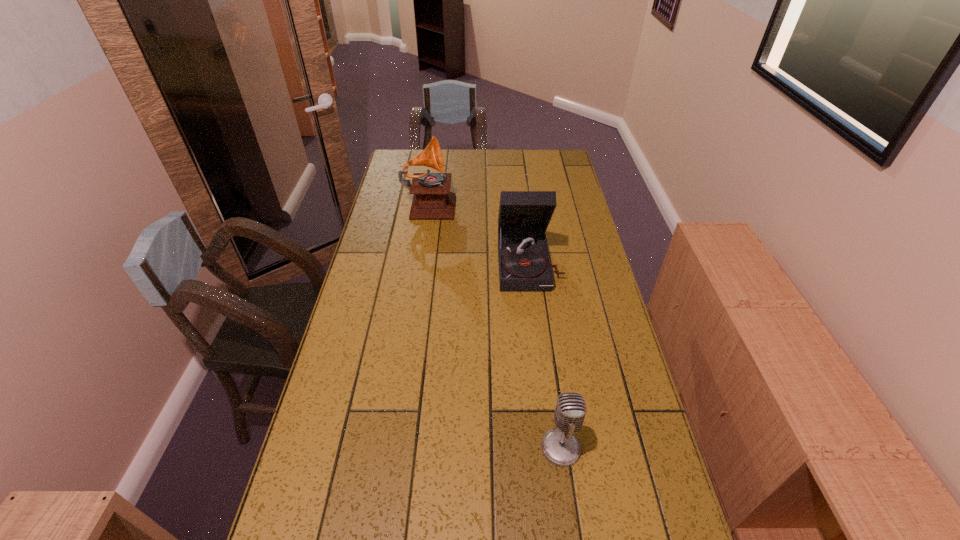
At what (x,y) coordinates should I click in order to perform the action: click on free space between the nearer phonograph_record and the nearest object. Please return your answer as a coordinate pair (x, y). The width and height of the screenshot is (960, 540). Looking at the image, I should click on (545, 355).

This screenshot has width=960, height=540. In order to click on free spot between the farther phonograph_record and the nearer phonograph_record in this screenshot , I will do `click(479, 233)`.

I want to click on blank region between the leftmost object and the right phonograph_record, so click(x=479, y=233).

I want to click on empty space between the second farthest object and the left phonograph_record, so click(479, 233).

This screenshot has height=540, width=960. I want to click on free spot between the right phonograph_record and the farthest object, so click(479, 233).

Select which object is the closest to the microphone. Please provide its 2D coordinates. Your answer should be formatted as a tuple, i.e. [(x, y)], where the tuple contains the x and y coordinates of a point satisfying the conditions above.

[(524, 263)]

Locate which object ranks second in proximity to the shortest object. Please provide its 2D coordinates. Your answer should be formatted as a tuple, i.e. [(x, y)], where the tuple contains the x and y coordinates of a point satisfying the conditions above.

[(432, 200)]

Where is `vacant space that satisfies the following two spatial constraints: 1. on the front-facing side of the nearest object; 2. on the left side of the second nearest object`? The image size is (960, 540). vacant space that satisfies the following two spatial constraints: 1. on the front-facing side of the nearest object; 2. on the left side of the second nearest object is located at coordinates (x=552, y=448).

Find the location of a particular element. Image resolution: width=960 pixels, height=540 pixels. vacant point that satisfies the following two spatial constraints: 1. on the horn of the left phonograph_record; 2. on the right side of the nearest object is located at coordinates (393, 448).

The image size is (960, 540). I want to click on blank area in the image that satisfies the following two spatial constraints: 1. on the horn of the shortest object; 2. on the left side of the farther phonograph_record, so click(x=393, y=448).